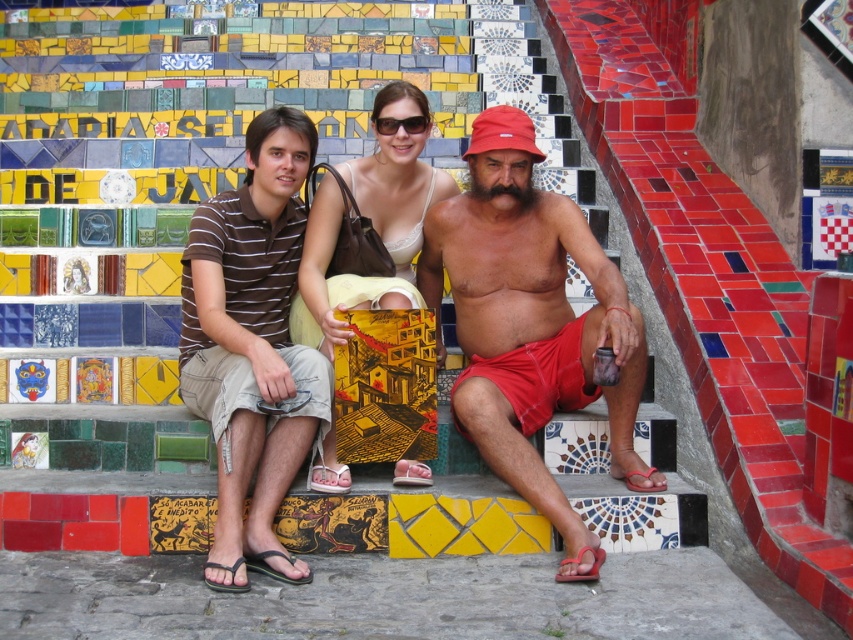
Measure the distance between matte brown shirt at center and brown striped shirt at left.

5.15 feet

Locate an element on the screen. This screenshot has height=640, width=853. matte brown shirt at center is located at coordinates (531, 323).

Does point (523, 408) lie behind point (537, 317)?

No, it is in front of (537, 317).

Is matte brown shirt at center below matte red shorts at center?

No.

Image resolution: width=853 pixels, height=640 pixels. Describe the element at coordinates (531, 323) in the screenshot. I see `matte brown shirt at center` at that location.

Identify the location of matte brown shirt at center. (531, 323).

Which is above, matte red shorts at center or brown striped shirt at left?

matte red shorts at center is above.

From the picture: Does matte red shorts at center have a smaller size compared to brown striped shirt at left?

Incorrect, matte red shorts at center is not smaller in size than brown striped shirt at left.

Between point (659, 474) and point (289, 108), which one is positioned behind?

Positioned behind is point (289, 108).

I want to click on matte red shorts at center, so click(531, 324).